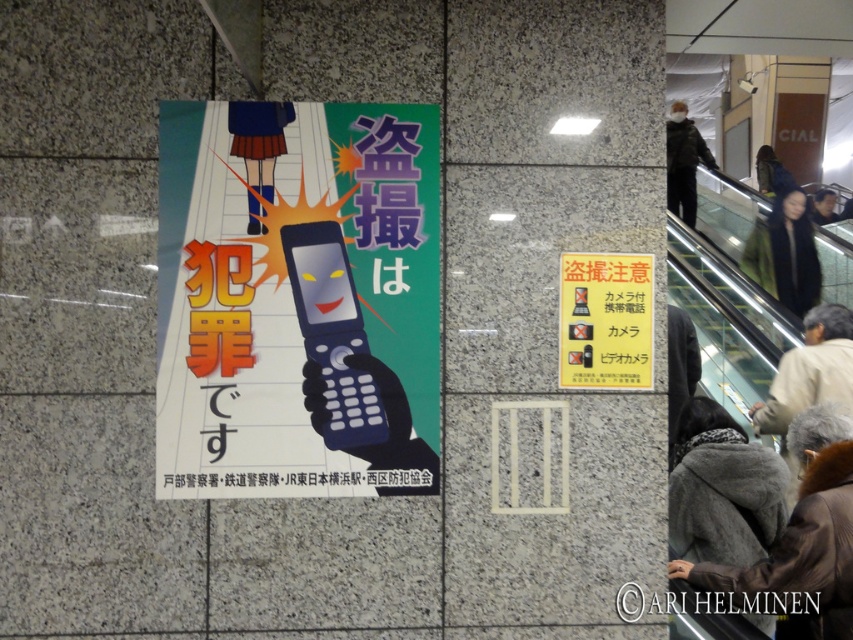
Is orange glossy sign at upper right bigger than light beige jacket at lower right?

No.

Who is taller, orange glossy sign at upper right or light beige jacket at lower right?

light beige jacket at lower right

This screenshot has height=640, width=853. What do you see at coordinates (605, 321) in the screenshot?
I see `orange glossy sign at upper right` at bounding box center [605, 321].

The image size is (853, 640). In order to click on orange glossy sign at upper right in this screenshot , I will do `click(605, 321)`.

Who is positioned more to the right, matte red skirt at upper center or dark blue jacket at upper right?

Positioned to the right is dark blue jacket at upper right.

Measure the distance between matte red skirt at upper center and camera.

matte red skirt at upper center and camera are 9.51 feet apart.

Locate an element on the screen. The image size is (853, 640). matte red skirt at upper center is located at coordinates (258, 140).

What do you see at coordinates (297, 300) in the screenshot?
I see `matte blue phone at center` at bounding box center [297, 300].

Does matte blue phone at center appear on the right side of light beige jacket at lower right?

Incorrect, matte blue phone at center is not on the right side of light beige jacket at lower right.

Who is more forward, (320, 460) or (795, 400)?

Point (320, 460) is more forward.

You are a GUI agent. You are given a task and a screenshot of the screen. Output one action in this format:
    pyautogui.click(x=<x>, y=<y>)
    Task: Click on the matte blue phone at center
    
    Given the screenshot: What is the action you would take?
    pyautogui.click(x=297, y=300)